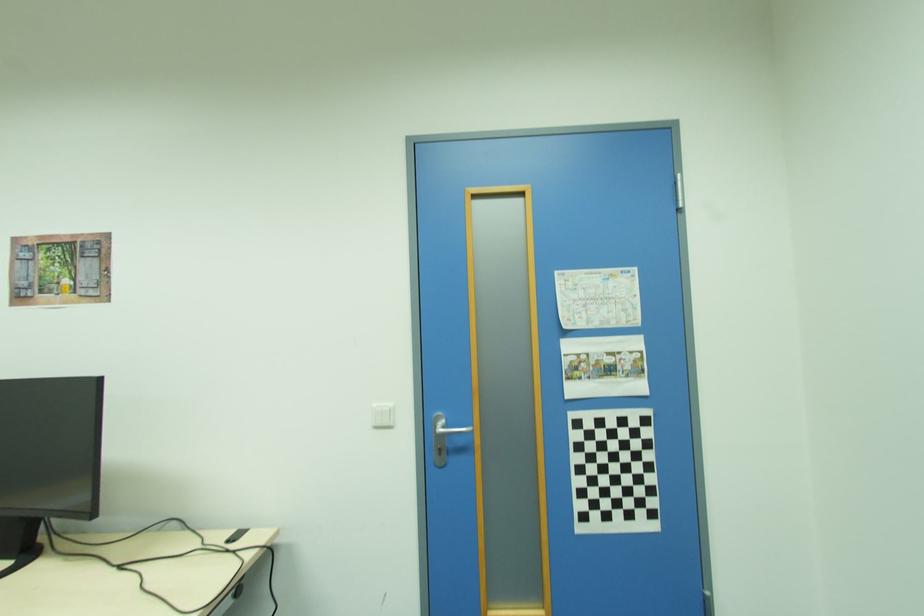
Image resolution: width=924 pixels, height=616 pixels. What are the coordinates of `silver door handle` in the screenshot? It's located at 451,430.